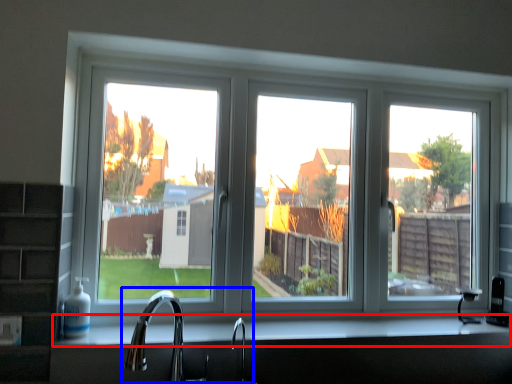
Question: Among these objects, which one is nearest to the camera, counter top (highlighted by a red box) or sink (highlighted by a blue box)?

Choices:
 (A) counter top
 (B) sink

Answer: (B)